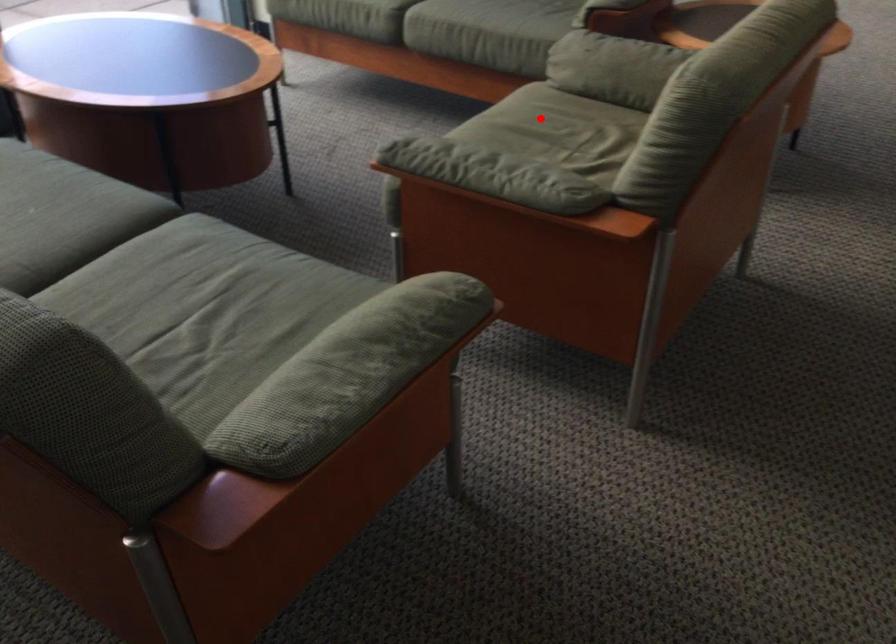
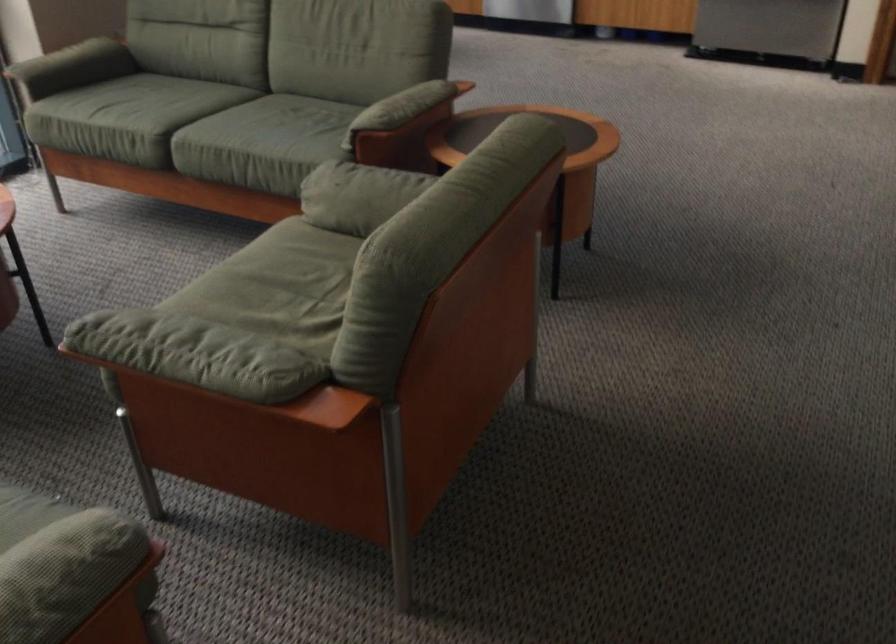
Locate, in the second image, the point that corresponds to the highlighted location in the first image.

(289, 260)